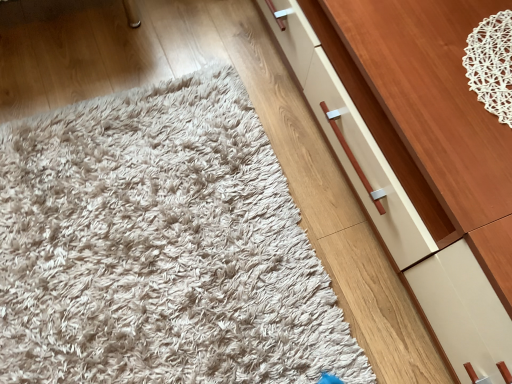
The height and width of the screenshot is (384, 512). In order to click on matte wood dresser at center in this screenshot , I will do `click(418, 156)`.

What do you see at coordinates (418, 156) in the screenshot? The image size is (512, 384). I see `matte wood dresser at center` at bounding box center [418, 156].

The image size is (512, 384). I want to click on matte wood dresser at center, so tap(418, 156).